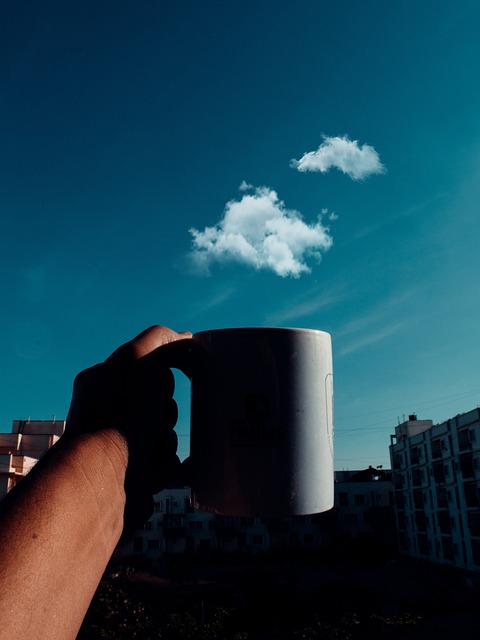
I want to click on mug, so click(x=313, y=452).